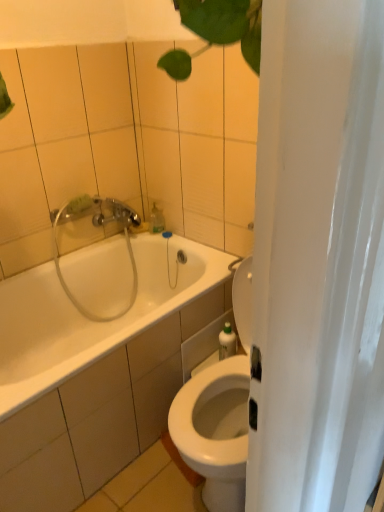
Question: Can we say green plastic bottle at right lies outside clear plastic showerhead at upper left?

Choices:
 (A) no
 (B) yes

Answer: (B)

Question: From a real-world perspective, is green plastic bottle at right under clear plastic showerhead at upper left?

Choices:
 (A) yes
 (B) no

Answer: (A)

Question: Is green plastic bottle at right facing towards clear plastic showerhead at upper left?

Choices:
 (A) yes
 (B) no

Answer: (B)

Question: Are green plastic bottle at right and clear plastic showerhead at upper left far apart?

Choices:
 (A) no
 (B) yes

Answer: (A)

Question: Does green plastic bottle at right have a greater height compared to clear plastic showerhead at upper left?

Choices:
 (A) no
 (B) yes

Answer: (A)

Question: From a real-world perspective, is green plastic bottle at right above or below clear plastic showerhead at upper left?

Choices:
 (A) above
 (B) below

Answer: (B)

Question: Is green plastic bottle at right taller or shorter than clear plastic showerhead at upper left?

Choices:
 (A) tall
 (B) short

Answer: (B)

Question: Is green plastic bottle at right spatially inside clear plastic showerhead at upper left, or outside of it?

Choices:
 (A) inside
 (B) outside

Answer: (B)

Question: Considering the positions of green plastic bottle at right and clear plastic showerhead at upper left in the image, is green plastic bottle at right bigger or smaller than clear plastic showerhead at upper left?

Choices:
 (A) big
 (B) small

Answer: (B)

Question: In the image, is clear plastic showerhead at upper left on the left side or the right side of translucent plastic soap dispenser at upper center?

Choices:
 (A) left
 (B) right

Answer: (A)

Question: From a real-world perspective, is clear plastic showerhead at upper left physically located above or below translucent plastic soap dispenser at upper center?

Choices:
 (A) above
 (B) below

Answer: (B)

Question: Is clear plastic showerhead at upper left inside or outside of translucent plastic soap dispenser at upper center?

Choices:
 (A) outside
 (B) inside

Answer: (A)

Question: Considering the positions of point (109, 198) and point (160, 222), is point (109, 198) closer or farther from the camera than point (160, 222)?

Choices:
 (A) closer
 (B) farther

Answer: (A)

Question: Considering the positions of point (150, 217) and point (61, 279), is point (150, 217) closer or farther from the camera than point (61, 279)?

Choices:
 (A) closer
 (B) farther

Answer: (B)

Question: In the image, is translucent plastic soap dispenser at upper center positioned in front of or behind clear plastic showerhead at upper left?

Choices:
 (A) front
 (B) behind

Answer: (B)